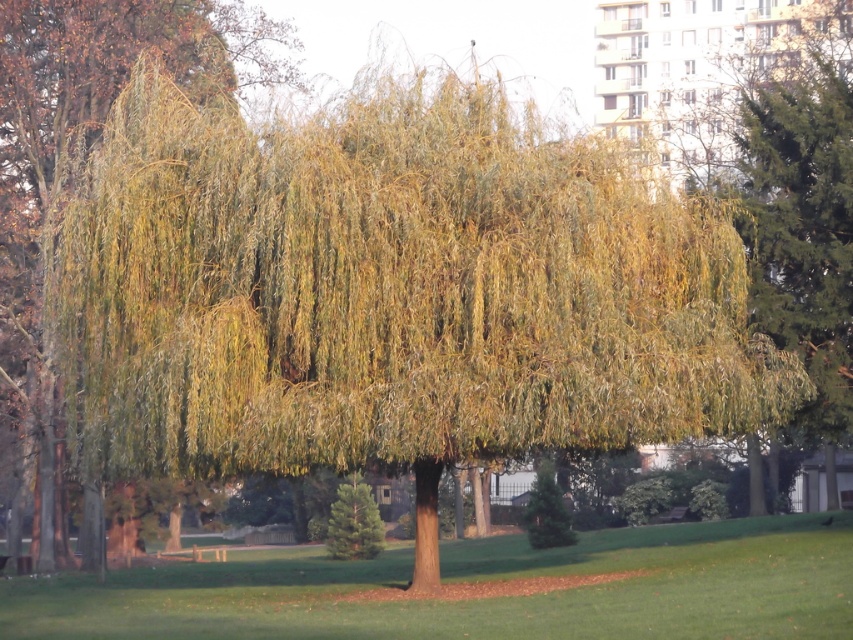
You are standing at the base of the large weeping willow tree in the image. You notice a point marked at coordinates (477,580). What is located at that point?

The point at coordinates (477,580) corresponds to green grass at center.